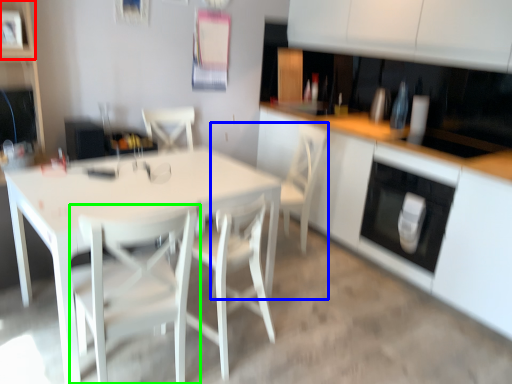
Question: Which object is positioned farthest from shelf (highlighted by a red box)? Select from armchair (highlighted by a blue box) and chair (highlighted by a green box).

Choices:
 (A) armchair
 (B) chair

Answer: (A)